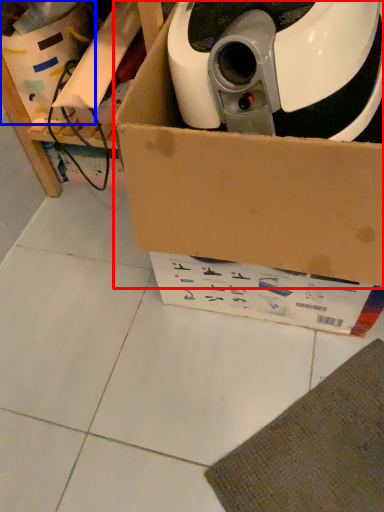
Question: Which object is closer to the camera taking this photo, box (highlighted by a red box) or storage box (highlighted by a blue box)?

Choices:
 (A) box
 (B) storage box

Answer: (A)